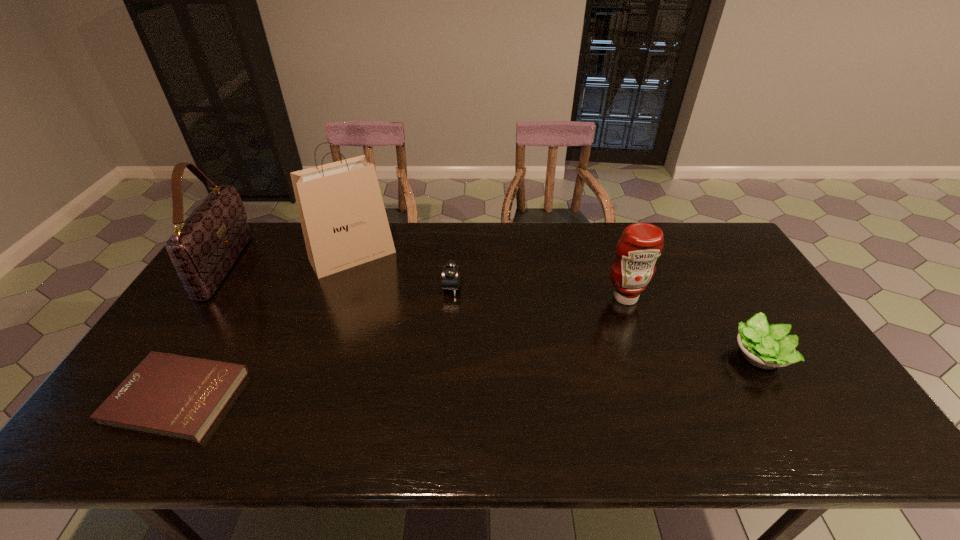
You are a GUI agent. You are given a task and a screenshot of the screen. Output one action in this format:
    pyautogui.click(x=<x>, y=<y>)
    Task: Click on the free space located on the front side of the fourth object from left to right
    
    Given the screenshot: What is the action you would take?
    pyautogui.click(x=563, y=288)

Where is `free space located on the back of the rightmost object`? free space located on the back of the rightmost object is located at coordinates (693, 245).

You are a GUI agent. You are given a task and a screenshot of the screen. Output one action in this format:
    pyautogui.click(x=<x>, y=<y>)
    Task: Click on the free spot located on the back of the hardback book
    
    Given the screenshot: What is the action you would take?
    pyautogui.click(x=248, y=280)

Locate an element on the screen. shopping bag at the far edge is located at coordinates (344, 223).

This screenshot has height=540, width=960. I want to click on handbag that is at the far edge, so click(205, 246).

Identify the location of object located at the near edge. (180, 397).

You are a GUI agent. You are given a task and a screenshot of the screen. Output one action in this format:
    pyautogui.click(x=<x>, y=<y>)
    Task: Click on the handbag that is at the left edge
    Image resolution: width=960 pixels, height=540 pixels.
    Given the screenshot: What is the action you would take?
    pyautogui.click(x=205, y=246)

Identify the location of hardback book located in the left edge section of the desktop. The width and height of the screenshot is (960, 540). (180, 397).

Locate an element on the screen. This screenshot has height=540, width=960. object that is at the right edge is located at coordinates (766, 346).

This screenshot has height=540, width=960. In order to click on object present at the far left corner in this screenshot , I will do `click(205, 246)`.